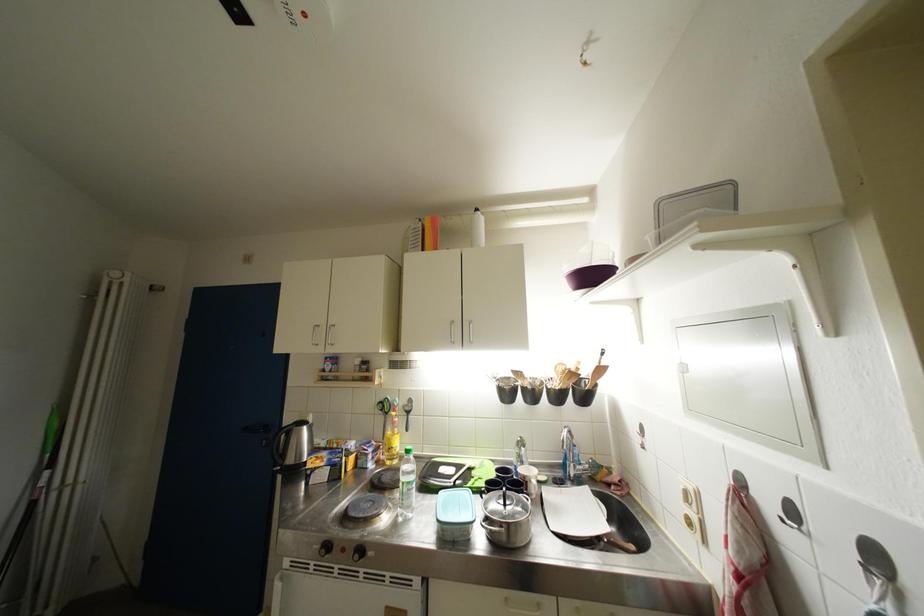
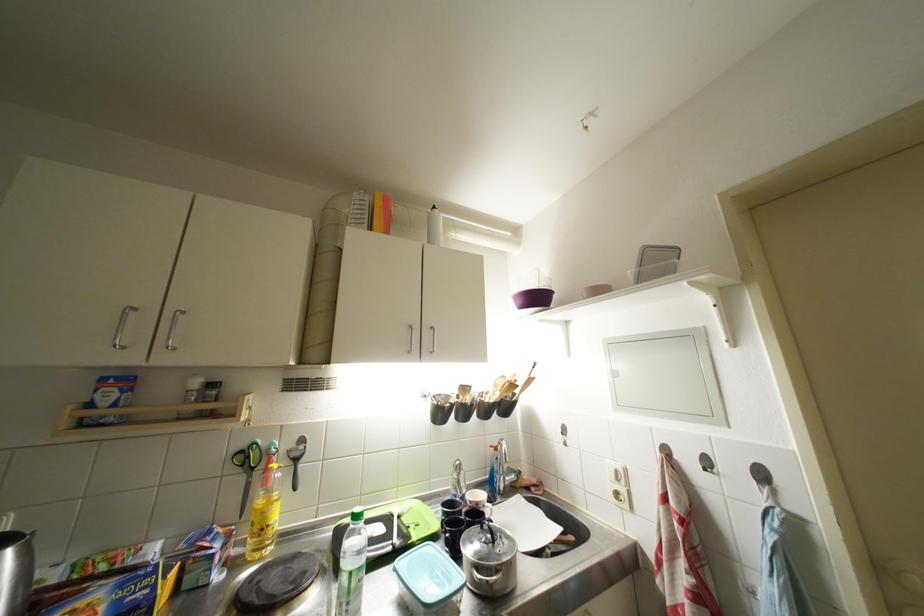
The point at (800, 517) is marked in the first image. Where is the corresponding point in the second image?

(714, 467)